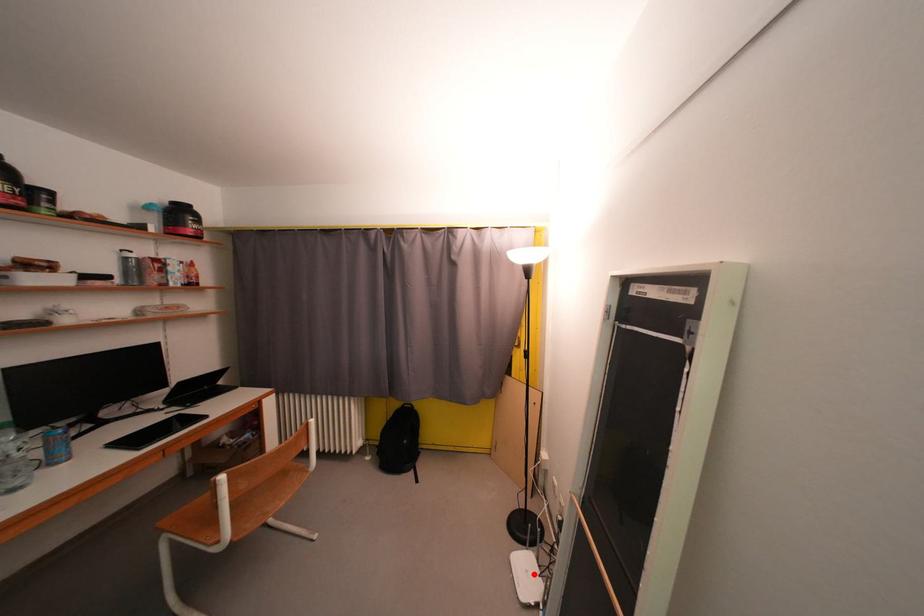
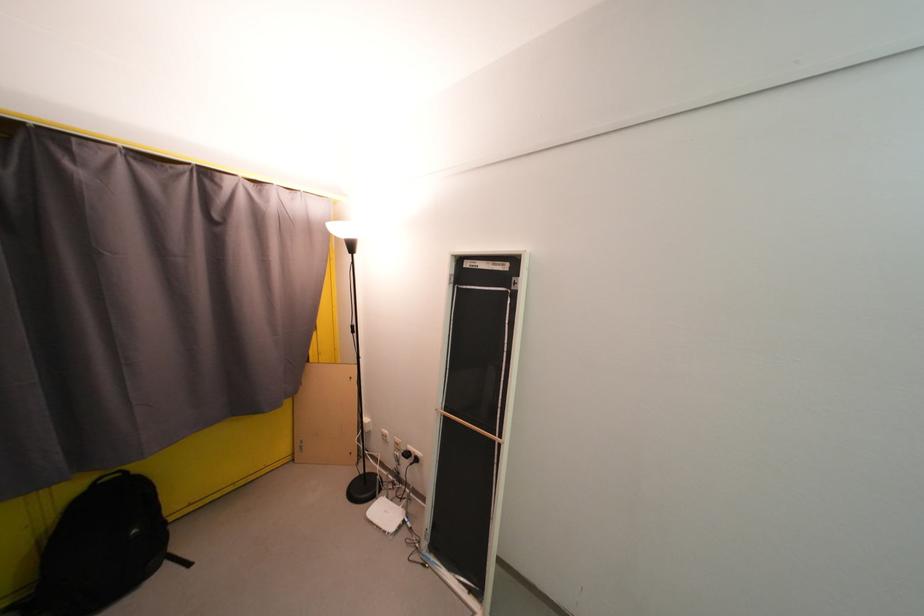
Locate, in the second image, the point that corresponds to the highlighted location in the first image.

(392, 515)